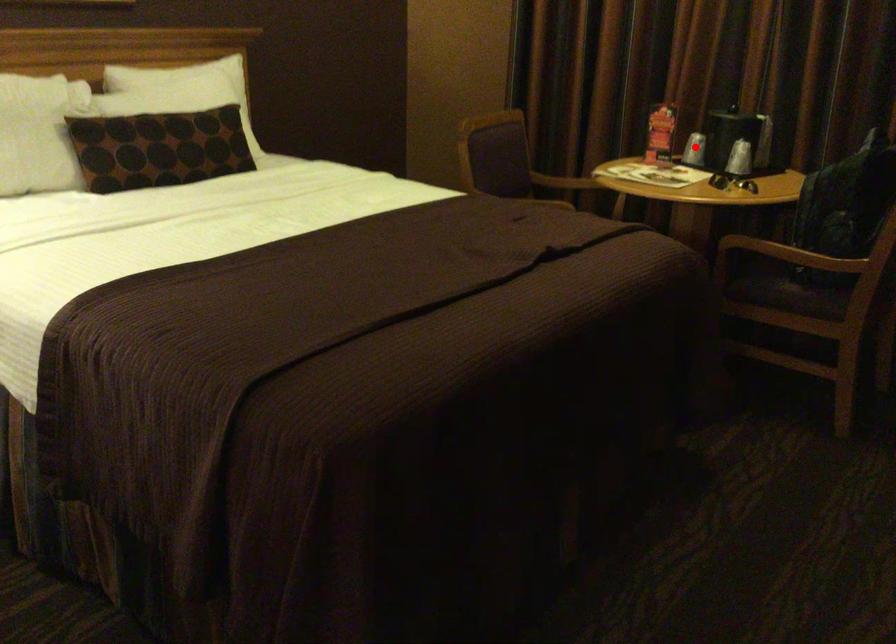
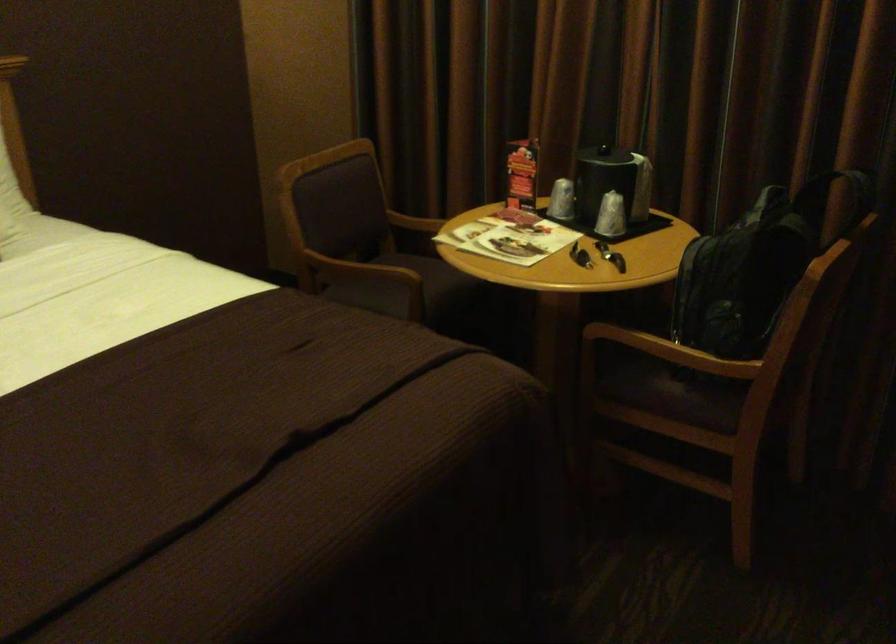
Find the pixel in the second image that matches the highlighted location in the first image.

(561, 200)